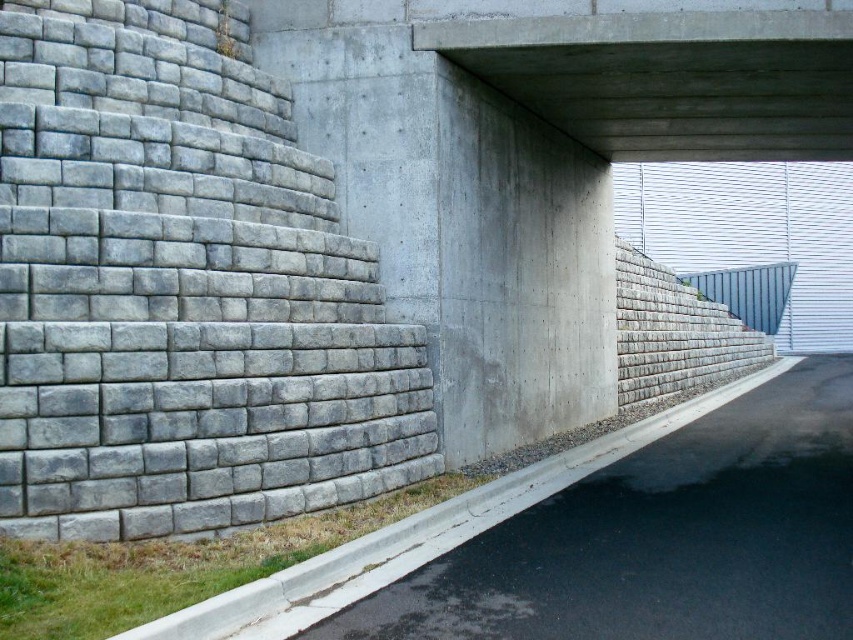
Can you confirm if gray concrete wall at left is positioned to the right of gray concrete curb at lower right?

Incorrect, gray concrete wall at left is not on the right side of gray concrete curb at lower right.

Measure the distance from gray concrete wall at left to gray concrete curb at lower right.

9.73 feet

The height and width of the screenshot is (640, 853). I want to click on gray concrete wall at left, so click(x=181, y=289).

This screenshot has width=853, height=640. I want to click on gray concrete wall at left, so click(181, 289).

The width and height of the screenshot is (853, 640). Find the location of `gray concrete curb at lower right`. gray concrete curb at lower right is located at coordinates (662, 538).

Does gray concrete curb at lower right have a lesser height compared to concrete at upper center?

Correct, gray concrete curb at lower right is not as tall as concrete at upper center.

Between point (807, 490) and point (433, 28), which one is positioned behind?

The point (433, 28) is more distant.

Where is `gray concrete curb at lower right`? Image resolution: width=853 pixels, height=640 pixels. gray concrete curb at lower right is located at coordinates (662, 538).

Does gray concrete wall at left have a larger size compared to concrete at upper center?

Incorrect, gray concrete wall at left is not larger than concrete at upper center.

Does gray concrete wall at left have a lesser width compared to concrete at upper center?

Yes.

Is point (177, 371) positioned behind point (767, 19)?

No.

The image size is (853, 640). Identify the location of gray concrete wall at left. (181, 289).